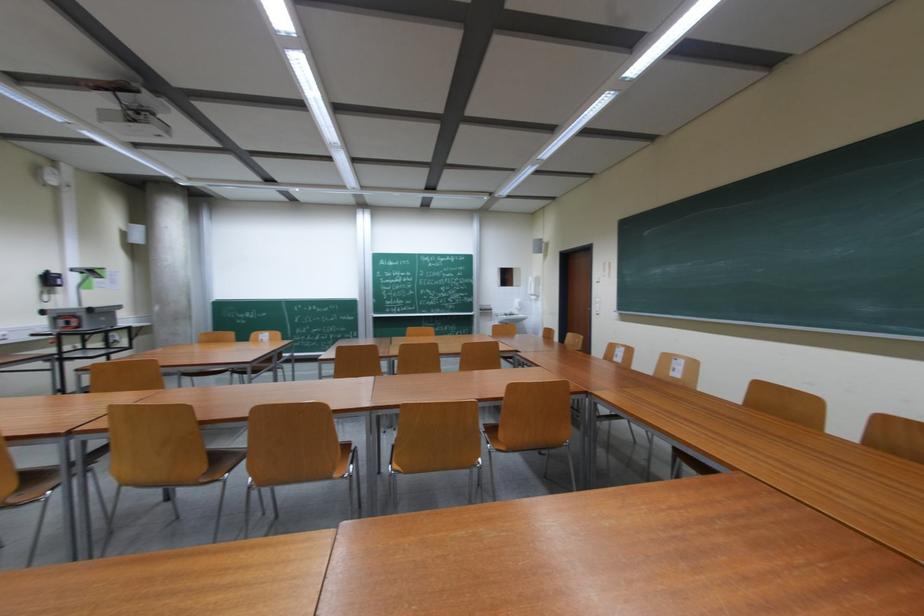
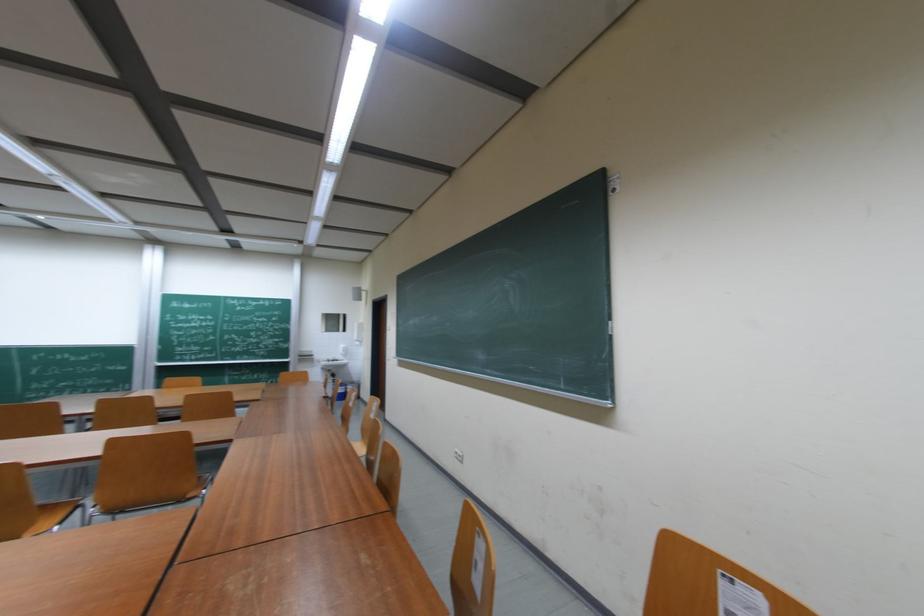
Question: In a continuous first-person perspective shot, in which direction is the camera moving?

Choices:
 (A) Left
 (B) Right
 (C) Forward
 (D) Backward

Answer: (B)